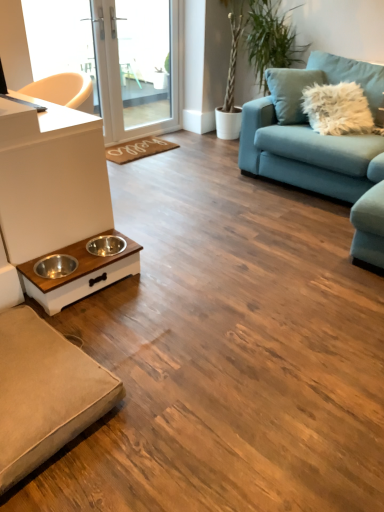
Locate an element on the screen. vacant space that is in between beige fabric studio couch at lower left, which is the first studio couch in bottom-to-top order, and teal fabric couch at upper right, which ranks as the 1th studio couch in right-to-left order is located at coordinates (221, 259).